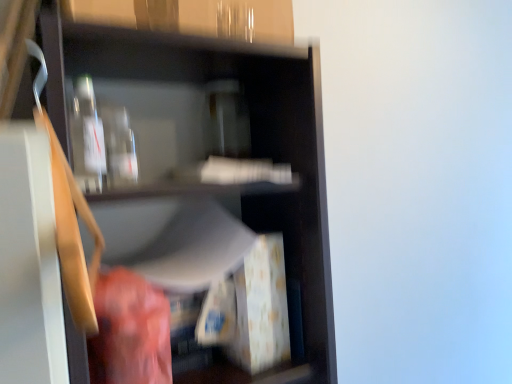
From the picture: What is the approximate width of transparent glass bottles at upper center?

The width of transparent glass bottles at upper center is 12.11 inches.

This screenshot has width=512, height=384. What do you see at coordinates (206, 156) in the screenshot?
I see `matte black shelf at center` at bounding box center [206, 156].

At what (x,y) coordinates should I click in order to perform the action: click on transparent glass bottles at upper center. Please return your answer as a coordinate pair (x, y). This screenshot has height=384, width=512. Looking at the image, I should click on (237, 8).

From the picture: Considering the sizes of objects transparent glass bottle at upper left and transparent glass bottles at upper center in the image provided, who is taller, transparent glass bottle at upper left or transparent glass bottles at upper center?

With more height is transparent glass bottles at upper center.

Is point (90, 151) farther from viewer compared to point (112, 19)?

Yes, point (90, 151) is behind point (112, 19).

What's the angular difference between transparent glass bottle at upper left and transparent glass bottles at upper center's facing directions?

The facing directions of transparent glass bottle at upper left and transparent glass bottles at upper center are 0.00341 degrees apart.

Is transparent glass bottle at upper left oriented away from transparent glass bottles at upper center?

No, transparent glass bottle at upper left is not facing the opposite direction of transparent glass bottles at upper center.

Is transparent glass bottle at upper left oriented towards matte black shelf at center?

Yes, transparent glass bottle at upper left is facing matte black shelf at center.

Is transparent glass bottle at upper left thinner than matte black shelf at center?

Indeed, transparent glass bottle at upper left has a lesser width compared to matte black shelf at center.

In the image, is transparent glass bottle at upper left positioned in front of or behind matte black shelf at center?

Visually, transparent glass bottle at upper left is located behind matte black shelf at center.

Are transparent glass bottle at upper left and matte black shelf at center making contact?

No, transparent glass bottle at upper left is not beside matte black shelf at center.

Considering the sizes of objects transparent glass bottles at upper center and matte black shelf at center in the image provided, who is wider, transparent glass bottles at upper center or matte black shelf at center?

matte black shelf at center.

Does point (129, 26) come behind point (147, 93)?

No, it is in front of (147, 93).

From a real-world perspective, is transparent glass bottles at upper center below matte black shelf at center?

No, from a real-world perspective, transparent glass bottles at upper center is not beneath matte black shelf at center.

What's the angular difference between transparent glass bottles at upper center and matte black shelf at center's facing directions?

0.9 degrees separate the facing orientations of transparent glass bottles at upper center and matte black shelf at center.

Is matte black shelf at center aimed at transparent glass bottles at upper center?

No, matte black shelf at center is not oriented towards transparent glass bottles at upper center.

Is matte black shelf at center next to transparent glass bottles at upper center?

No, matte black shelf at center is not touching transparent glass bottles at upper center.

From a real-world perspective, is matte black shelf at center beneath transparent glass bottles at upper center?

Correct, in the physical world, matte black shelf at center is lower than transparent glass bottles at upper center.

Which object is further away from the camera, matte black shelf at center or transparent glass bottles at upper center?

Positioned behind is transparent glass bottles at upper center.

Does transparent glass bottles at upper center have a greater width compared to transparent glass bottle at upper left?

Indeed, transparent glass bottles at upper center has a greater width compared to transparent glass bottle at upper left.

In the scene shown: Can you confirm if transparent glass bottles at upper center is bigger than transparent glass bottle at upper left?

Yes, transparent glass bottles at upper center is bigger than transparent glass bottle at upper left.

Based on the photo, considering the sizes of objects transparent glass bottles at upper center and transparent glass bottle at upper left in the image provided, who is shorter, transparent glass bottles at upper center or transparent glass bottle at upper left?

transparent glass bottle at upper left.

Image resolution: width=512 pixels, height=384 pixels. What are the coordinates of `bottle lying on the left of transparent glass bottles at upper center` in the screenshot? It's located at (88, 139).

Does matte black shelf at center appear on the right side of transparent glass bottle at upper left?

Correct, you'll find matte black shelf at center to the right of transparent glass bottle at upper left.

Relative to transparent glass bottle at upper left, is matte black shelf at center in front or behind?

matte black shelf at center is in front of transparent glass bottle at upper left.

Which is more distant, (325, 372) or (88, 104)?

Point (325, 372)

Where is `bottle on the left of the matte black shelf at center`? The width and height of the screenshot is (512, 384). bottle on the left of the matte black shelf at center is located at coordinates (88, 139).

Image resolution: width=512 pixels, height=384 pixels. I want to click on cabinetry above the transparent glass bottle at upper left (from a real-world perspective), so click(x=237, y=8).

In the image, there is a transparent glass bottle at upper left. At what (x,y) coordinates should I click in order to perform the action: click on shelf below it (from a real-world perspective). Please return your answer as a coordinate pair (x, y). This screenshot has height=384, width=512. Looking at the image, I should click on (206, 156).

From the image, which object appears to be farther from transparent glass bottles at upper center, matte black shelf at center or transparent glass bottle at upper left?

Based on the image, matte black shelf at center appears to be further to transparent glass bottles at upper center.

When comparing their distances from transparent glass bottle at upper left, does transparent glass bottles at upper center or matte black shelf at center seem closer?

transparent glass bottles at upper center is positioned closer to the anchor transparent glass bottle at upper left.

Considering their positions, is transparent glass bottle at upper left positioned further to matte black shelf at center than transparent glass bottles at upper center?

transparent glass bottles at upper center is further to matte black shelf at center.

Which object lies nearer to the anchor point matte black shelf at center, transparent glass bottles at upper center or transparent glass bottle at upper left?

transparent glass bottle at upper left is positioned closer to the anchor matte black shelf at center.

In the scene shown: When comparing their distances from transparent glass bottles at upper center, does transparent glass bottle at upper left or matte black shelf at center seem closer?

transparent glass bottle at upper left is closer to transparent glass bottles at upper center.

Based on their spatial positions, is matte black shelf at center or transparent glass bottles at upper center closer to transparent glass bottle at upper left?

Based on the image, transparent glass bottles at upper center appears to be nearer to transparent glass bottle at upper left.

At what (x,y) coordinates should I click in order to perform the action: click on bottle between transparent glass bottles at upper center and matte black shelf at center from top to bottom. Please return your answer as a coordinate pair (x, y). Looking at the image, I should click on (88, 139).